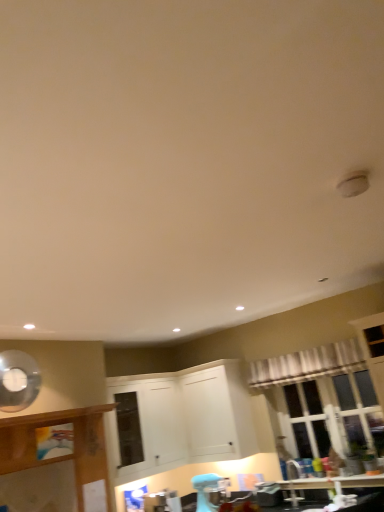
What do you see at coordinates (146, 425) in the screenshot? The height and width of the screenshot is (512, 384). I see `white matte cabinet at center, which is the 2th cabinetry from right to left` at bounding box center [146, 425].

What is the approximate width of white matte cabinet at center, arranged as the 3th cabinetry when viewed from the left?

white matte cabinet at center, arranged as the 3th cabinetry when viewed from the left, is 16.04 inches in width.

Describe the element at coordinates (217, 411) in the screenshot. I see `white matte cabinet at center, the 1th cabinetry in the right-to-left sequence` at that location.

The width and height of the screenshot is (384, 512). Find the location of `white sheer curtain at upper right`. white sheer curtain at upper right is located at coordinates (307, 364).

Locate an element on the screen. The image size is (384, 512). white matte cabinet at center, which is the 2th cabinetry from right to left is located at coordinates (146, 425).

Can you confirm if white sheer curtain at upper right is positioned to the left of white matte cabinet at center, arranged as the 3th cabinetry when viewed from the left?

In fact, white sheer curtain at upper right is to the right of white matte cabinet at center, arranged as the 3th cabinetry when viewed from the left.

Is there a large distance between white sheer curtain at upper right and white matte cabinet at center, the 1th cabinetry in the right-to-left sequence?

No, there isn't a large distance between white sheer curtain at upper right and white matte cabinet at center, the 1th cabinetry in the right-to-left sequence.

Which cabinetry is the 2nd one when counting from the back of the white sheer curtain at upper right? Please provide its 2D coordinates.

[(217, 411)]

Considering the sizes of objects white sheer curtain at upper right and white matte cabinet at center, arranged as the 3th cabinetry when viewed from the left, in the image provided, who is taller, white sheer curtain at upper right or white matte cabinet at center, arranged as the 3th cabinetry when viewed from the left,?

With more height is white matte cabinet at center, arranged as the 3th cabinetry when viewed from the left.

From the image's perspective, is white matte cabinet at center, the 1th cabinetry in the right-to-left sequence, over wooden cabinet at left, the 1th cabinetry from the left?

No, from the image's perspective, white matte cabinet at center, the 1th cabinetry in the right-to-left sequence, is not above wooden cabinet at left, the 1th cabinetry from the left.

Locate an element on the screen. This screenshot has width=384, height=512. the 1st cabinetry positioned below the wooden cabinet at left, the 1th cabinetry from the left (from the image's perspective) is located at coordinates (217, 411).

Is point (210, 399) less distant than point (23, 463)?

No.

Looking at their sizes, would you say white matte cabinet at center, the 1th cabinetry in the right-to-left sequence, is wider or thinner than wooden cabinet at left, the 1th cabinetry from the left?

Considering their sizes, white matte cabinet at center, the 1th cabinetry in the right-to-left sequence, looks broader than wooden cabinet at left, the 1th cabinetry from the left.

From a real-world perspective, is white matte cabinet at center, the 1th cabinetry in the right-to-left sequence, above or below white sheer curtain at upper right?

From a real-world perspective, white matte cabinet at center, the 1th cabinetry in the right-to-left sequence, is physically below white sheer curtain at upper right.

Between white matte cabinet at center, the 1th cabinetry in the right-to-left sequence, and white sheer curtain at upper right, which one appears on the left side from the viewer's perspective?

white matte cabinet at center, the 1th cabinetry in the right-to-left sequence.

How different are the orientations of white matte cabinet at center, the 1th cabinetry in the right-to-left sequence, and white sheer curtain at upper right in degrees?

0.698 degrees.

Which of these two, white matte cabinet at center, arranged as the 3th cabinetry when viewed from the left, or white sheer curtain at upper right, is smaller?

Smaller between the two is white sheer curtain at upper right.

How distant is white matte cabinet at center, arranged as the second cabinetry when viewed from the left, from wooden cabinet at left, the 3th cabinetry when ordered from right to left?

white matte cabinet at center, arranged as the second cabinetry when viewed from the left, and wooden cabinet at left, the 3th cabinetry when ordered from right to left, are 23.71 inches apart.

Considering the relative positions of white matte cabinet at center, which is the 2th cabinetry from right to left, and wooden cabinet at left, the 3th cabinetry when ordered from right to left, in the image provided, is white matte cabinet at center, which is the 2th cabinetry from right to left, behind wooden cabinet at left, the 3th cabinetry when ordered from right to left,?

Yes, it is.

Between white matte cabinet at center, which is the 2th cabinetry from right to left, and wooden cabinet at left, the 1th cabinetry from the left, which one has more height?

With more height is white matte cabinet at center, which is the 2th cabinetry from right to left.

Is point (135, 431) closer or farther from the camera than point (106, 472)?

Point (135, 431) is positioned farther from the camera compared to point (106, 472).

Can we say wooden cabinet at left, the 1th cabinetry from the left, lies outside white matte cabinet at center, arranged as the 3th cabinetry when viewed from the left?

Absolutely, wooden cabinet at left, the 1th cabinetry from the left, is external to white matte cabinet at center, arranged as the 3th cabinetry when viewed from the left.

Where is `cabinetry above the white matte cabinet at center, the 1th cabinetry in the right-to-left sequence (from the image's perspective)`? Image resolution: width=384 pixels, height=512 pixels. cabinetry above the white matte cabinet at center, the 1th cabinetry in the right-to-left sequence (from the image's perspective) is located at coordinates (60, 456).

Can you confirm if wooden cabinet at left, the 3th cabinetry when ordered from right to left, is taller than white matte cabinet at center, arranged as the 3th cabinetry when viewed from the left?

No.

Does point (93, 417) come in front of point (188, 383)?

Yes, it is in front of point (188, 383).

Is white sheer curtain at upper right placed right next to white matte cabinet at center, which is the 2th cabinetry from right to left?

No, white sheer curtain at upper right is not next to white matte cabinet at center, which is the 2th cabinetry from right to left.

Considering the relative positions of white sheer curtain at upper right and white matte cabinet at center, arranged as the second cabinetry when viewed from the left, in the image provided, is white sheer curtain at upper right to the right of white matte cabinet at center, arranged as the second cabinetry when viewed from the left, from the viewer's perspective?

Correct, you'll find white sheer curtain at upper right to the right of white matte cabinet at center, arranged as the second cabinetry when viewed from the left.

How distant is white sheer curtain at upper right from white matte cabinet at center, which is the 2th cabinetry from right to left?

The distance of white sheer curtain at upper right from white matte cabinet at center, which is the 2th cabinetry from right to left, is 1.26 meters.

Visually, is white matte cabinet at center, which is the 2th cabinetry from right to left, positioned to the left or to the right of white matte cabinet at center, arranged as the 3th cabinetry when viewed from the left?

From the image, it's evident that white matte cabinet at center, which is the 2th cabinetry from right to left, is to the left of white matte cabinet at center, arranged as the 3th cabinetry when viewed from the left.

Is white matte cabinet at center, arranged as the second cabinetry when viewed from the left, oriented away from white matte cabinet at center, the 1th cabinetry in the right-to-left sequence?

No, white matte cabinet at center, the 1th cabinetry in the right-to-left sequence, is not at the back of white matte cabinet at center, arranged as the second cabinetry when viewed from the left.

Considering the relative sizes of white matte cabinet at center, arranged as the second cabinetry when viewed from the left, and white matte cabinet at center, arranged as the 3th cabinetry when viewed from the left, in the image provided, is white matte cabinet at center, arranged as the second cabinetry when viewed from the left, smaller than white matte cabinet at center, arranged as the 3th cabinetry when viewed from the left,?

Yes.

Does white matte cabinet at center, arranged as the second cabinetry when viewed from the left, have a greater width compared to white matte cabinet at center, the 1th cabinetry in the right-to-left sequence?

Incorrect, the width of white matte cabinet at center, arranged as the second cabinetry when viewed from the left, does not surpass that of white matte cabinet at center, the 1th cabinetry in the right-to-left sequence.

This screenshot has height=512, width=384. I want to click on the 2nd cabinetry behind the white sheer curtain at upper right, so click(217, 411).

From a real-world perspective, which cabinetry is the 2nd one above the wooden cabinet at left, the 1th cabinetry from the left? Please provide its 2D coordinates.

[(217, 411)]

From the picture: From the image, which object appears to be nearer to white matte cabinet at center, the 1th cabinetry in the right-to-left sequence, wooden cabinet at left, the 1th cabinetry from the left, or white sheer curtain at upper right?

white sheer curtain at upper right is closer to white matte cabinet at center, the 1th cabinetry in the right-to-left sequence.

Looking at the image, which one is located further to wooden cabinet at left, the 1th cabinetry from the left, white sheer curtain at upper right or white matte cabinet at center, which is the 2th cabinetry from right to left?

Based on the image, white sheer curtain at upper right appears to be further to wooden cabinet at left, the 1th cabinetry from the left.

From the image, which object appears to be nearer to wooden cabinet at left, the 3th cabinetry when ordered from right to left, white matte cabinet at center, the 1th cabinetry in the right-to-left sequence, or white matte cabinet at center, arranged as the second cabinetry when viewed from the left?

Among the two, white matte cabinet at center, arranged as the second cabinetry when viewed from the left, is located nearer to wooden cabinet at left, the 3th cabinetry when ordered from right to left.

Considering their positions, is wooden cabinet at left, the 1th cabinetry from the left, positioned further to white sheer curtain at upper right than white matte cabinet at center, which is the 2th cabinetry from right to left?

wooden cabinet at left, the 1th cabinetry from the left, is further to white sheer curtain at upper right.

Which object lies further to the anchor point white matte cabinet at center, arranged as the second cabinetry when viewed from the left, white matte cabinet at center, the 1th cabinetry in the right-to-left sequence, or wooden cabinet at left, the 3th cabinetry when ordered from right to left?

Based on the image, wooden cabinet at left, the 3th cabinetry when ordered from right to left, appears to be further to white matte cabinet at center, arranged as the second cabinetry when viewed from the left.

Estimate the real-world distances between objects in this image. Which object is closer to white matte cabinet at center, the 1th cabinetry in the right-to-left sequence, wooden cabinet at left, the 1th cabinetry from the left, or white matte cabinet at center, arranged as the second cabinetry when viewed from the left?

white matte cabinet at center, arranged as the second cabinetry when viewed from the left, lies closer to white matte cabinet at center, the 1th cabinetry in the right-to-left sequence, than the other object.

Considering their positions, is white sheer curtain at upper right positioned closer to white matte cabinet at center, the 1th cabinetry in the right-to-left sequence, than wooden cabinet at left, the 3th cabinetry when ordered from right to left?

Among the two, white sheer curtain at upper right is located nearer to white matte cabinet at center, the 1th cabinetry in the right-to-left sequence.

Estimate the real-world distances between objects in this image. Which object is further from wooden cabinet at left, the 1th cabinetry from the left, white matte cabinet at center, the 1th cabinetry in the right-to-left sequence, or white sheer curtain at upper right?

white sheer curtain at upper right lies further to wooden cabinet at left, the 1th cabinetry from the left, than the other object.

The width and height of the screenshot is (384, 512). I want to click on cabinetry located between white matte cabinet at center, which is the 2th cabinetry from right to left, and white sheer curtain at upper right in the left-right direction, so click(217, 411).

In order to click on cabinetry between wooden cabinet at left, the 1th cabinetry from the left, and white matte cabinet at center, the 1th cabinetry in the right-to-left sequence, along the z-axis in this screenshot , I will do `click(146, 425)`.